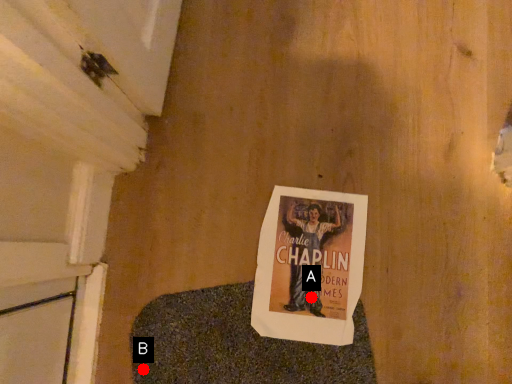
Question: Two points are circled on the image, labeled by A and B beside each circle. Which point is closer to the camera taking this photo?

Choices:
 (A) A is closer
 (B) B is closer

Answer: (B)